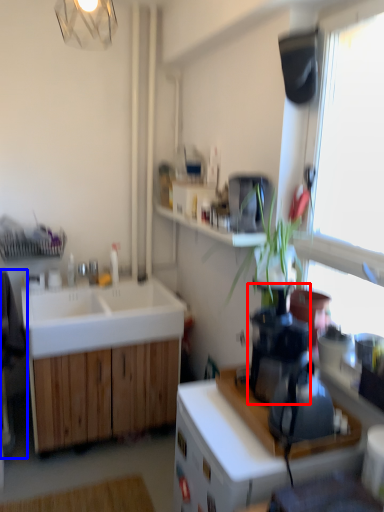
Question: Which object appears closest to the camera in this image, coffee machine (highlighted by a red box) or swivel chair (highlighted by a blue box)?

Choices:
 (A) coffee machine
 (B) swivel chair

Answer: (A)